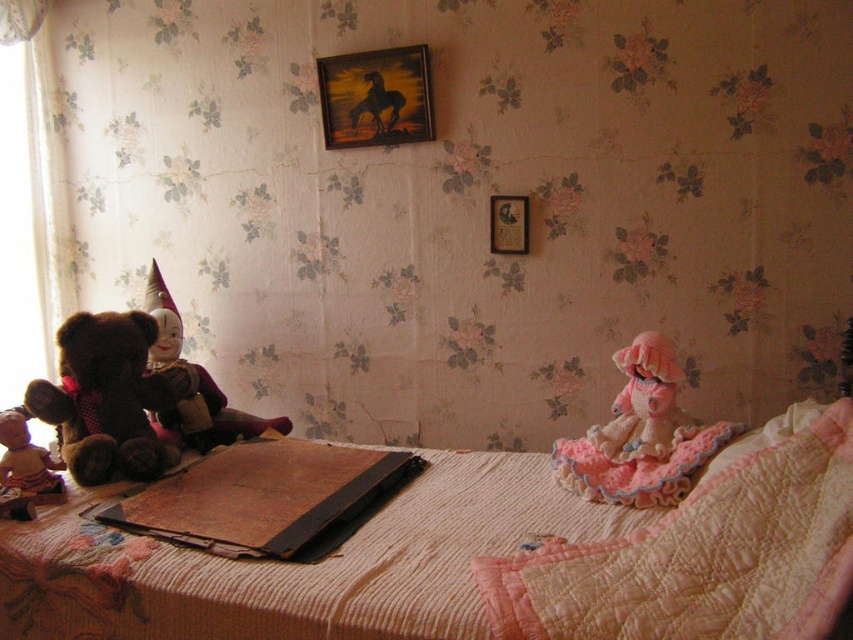
Question: Does matte brown teddy bear at left appear on the left side of wooden picture frame at upper center?

Choices:
 (A) no
 (B) yes

Answer: (B)

Question: Is matte pink doll at lower left further to camera compared to black glossy horse at upper center?

Choices:
 (A) no
 (B) yes

Answer: (A)

Question: Does brown plush teddy bear at left have a greater width compared to knitted pink doll at right?

Choices:
 (A) no
 (B) yes

Answer: (B)

Question: Which object is the farthest from the knitted pink doll at right?

Choices:
 (A) matte pink doll at lower left
 (B) white quilted bed at center
 (C) matte brown teddy bear at left
 (D) pink crocheted doll at right

Answer: (A)

Question: Estimate the real-world distances between objects in this image. Which object is closer to the pink crocheted doll at right?

Choices:
 (A) wooden picture frame at upper center
 (B) wooden framed painting at upper center
 (C) black glossy horse at upper center
 (D) matte brown teddy bear at left

Answer: (A)

Question: Which object appears farthest from the camera in this image?

Choices:
 (A) pink crocheted doll at right
 (B) matte pink doll at lower left
 (C) matte brown teddy bear at left

Answer: (C)